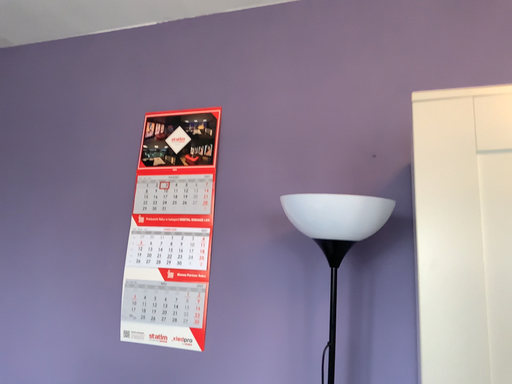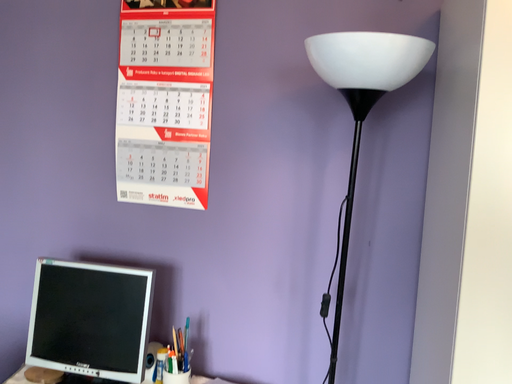
Question: How did the camera likely rotate when shooting the video?

Choices:
 (A) rotated downward
 (B) rotated upward

Answer: (A)